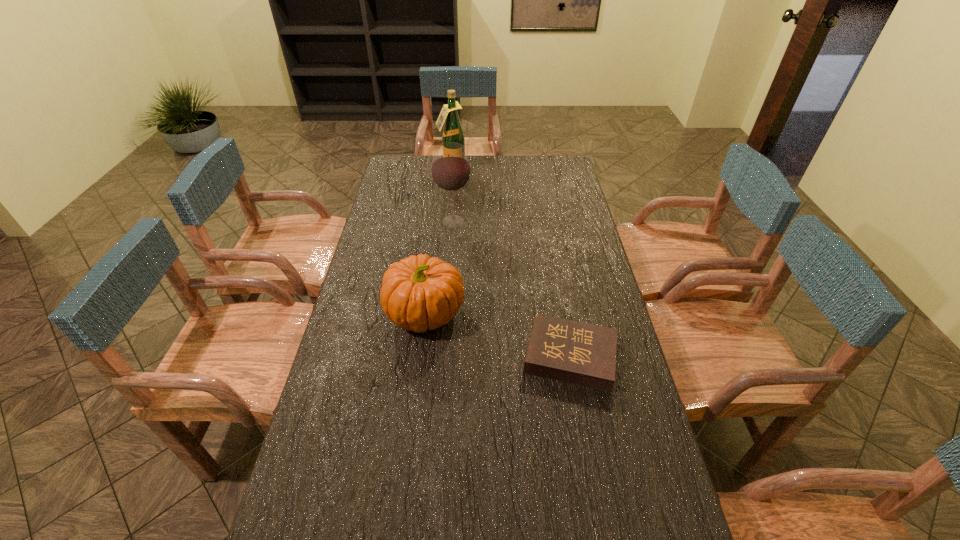
Where is `free space that satisfies the following two spatial constraints: 1. on the front-facing side of the liquor; 2. on the right side of the rightmost object`? The image size is (960, 540). free space that satisfies the following two spatial constraints: 1. on the front-facing side of the liquor; 2. on the right side of the rightmost object is located at coordinates (435, 356).